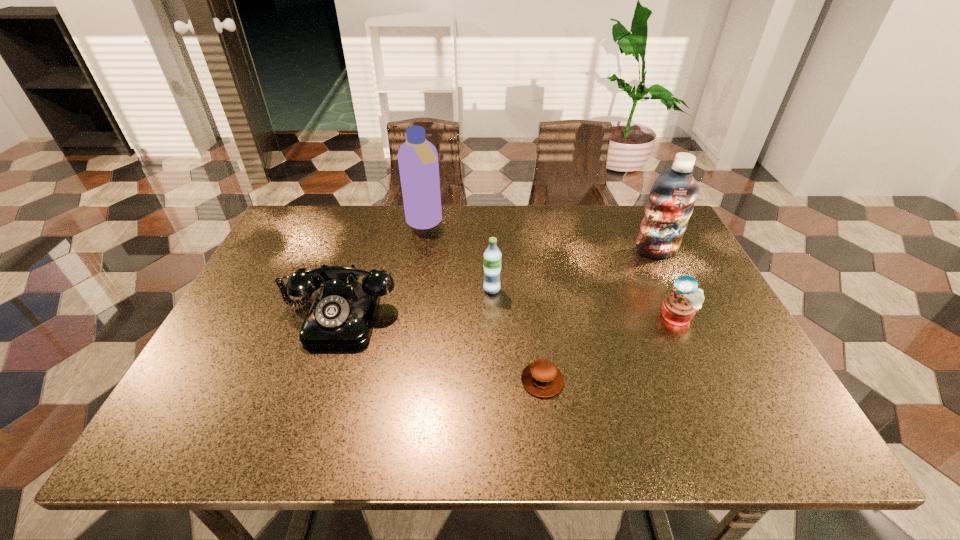
I want to click on vacant point located between the second farthest object and the farther muffin, so click(x=667, y=284).

Where is `vacant area that lies between the right shampoo and the taller muffin`? This screenshot has width=960, height=540. vacant area that lies between the right shampoo and the taller muffin is located at coordinates coord(667,284).

The image size is (960, 540). I want to click on free spot between the second farthest object and the shorter muffin, so click(599, 316).

Image resolution: width=960 pixels, height=540 pixels. Identify the location of free spot between the right muffin and the telephone. (509, 316).

This screenshot has height=540, width=960. What are the coordinates of `vacant region between the farthest object and the third tallest object` in the screenshot? It's located at (458, 256).

The width and height of the screenshot is (960, 540). I want to click on free space between the taller muffin and the nearer shampoo, so click(667, 284).

Choose which object is the fifth nearest neighbor to the fourth shortest object. Please provide its 2D coordinates. Your answer should be formatted as a tuple, i.e. [(x, y)], where the tuple contains the x and y coordinates of a point satisfying the conditions above.

[(671, 201)]

Locate which object is the fourth closest to the third object from left to right. Please provide its 2D coordinates. Your answer should be formatted as a tuple, i.e. [(x, y)], where the tuple contains the x and y coordinates of a point satisfying the conditions above.

[(679, 307)]

The height and width of the screenshot is (540, 960). What are the coordinates of `vacant space that satisfies the following two spatial constraints: 1. on the front side of the fourth object from right to left; 2. on the left side of the left shampoo` in the screenshot? It's located at (413, 289).